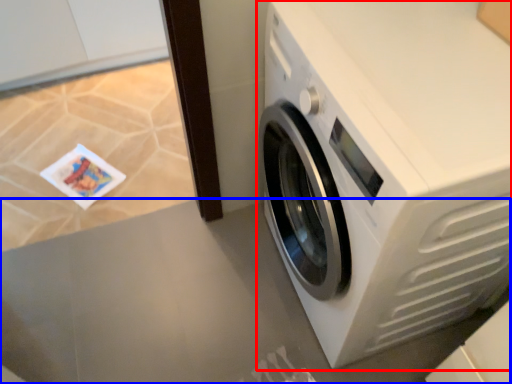
Question: Which object appears closest to the camera in this image, washing machine (highlighted by a red box) or table top (highlighted by a blue box)?

Choices:
 (A) washing machine
 (B) table top

Answer: (A)